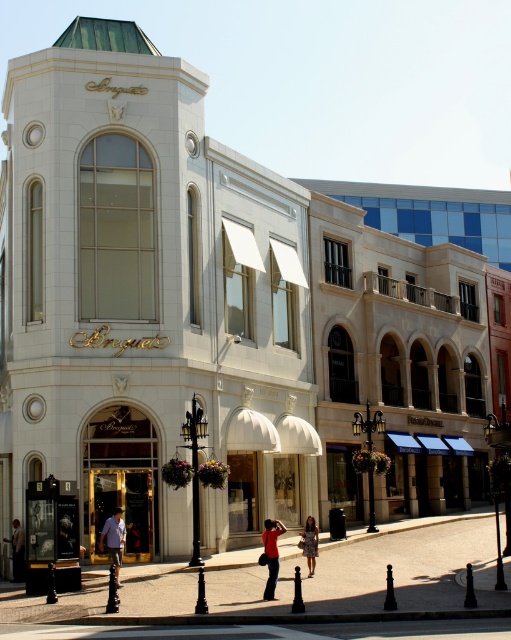
You are a fashion designer who wants to display two outfits in a store window. The red fabric shirt at center and the printed fabric dress at center need to be placed in the window. The store requires that the outfits must be at least 3 meters apart to ensure visibility. Can you place them according to the requirement?

The red fabric shirt at center and the printed fabric dress at center are 3.54 meters apart from each other, which meets the store requirement of at least 3 meters. Therefore, they can be placed as required.

You are a fashion designer observing a mannequin display in the Breguet store. You see a light blue shirt at center and a printed fabric dress at center. Which clothing item is shorter in height?

The light blue shirt at center has a lesser height compared to the printed fabric dress at center, so the light blue shirt at center is shorter in height.